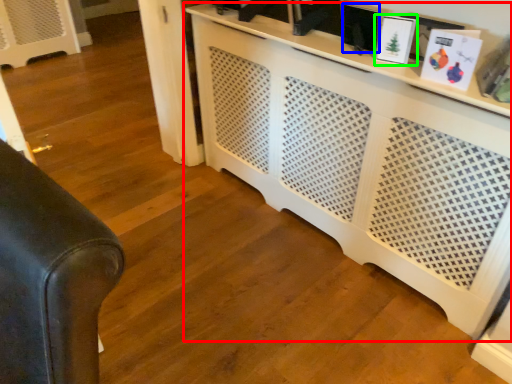
Question: Estimate the real-world distances between objects in this image. Which object is farther from entertainment center (highlighted by a red box), picture frame (highlighted by a blue box) or picture frame (highlighted by a green box)?

Choices:
 (A) picture frame
 (B) picture frame

Answer: (B)